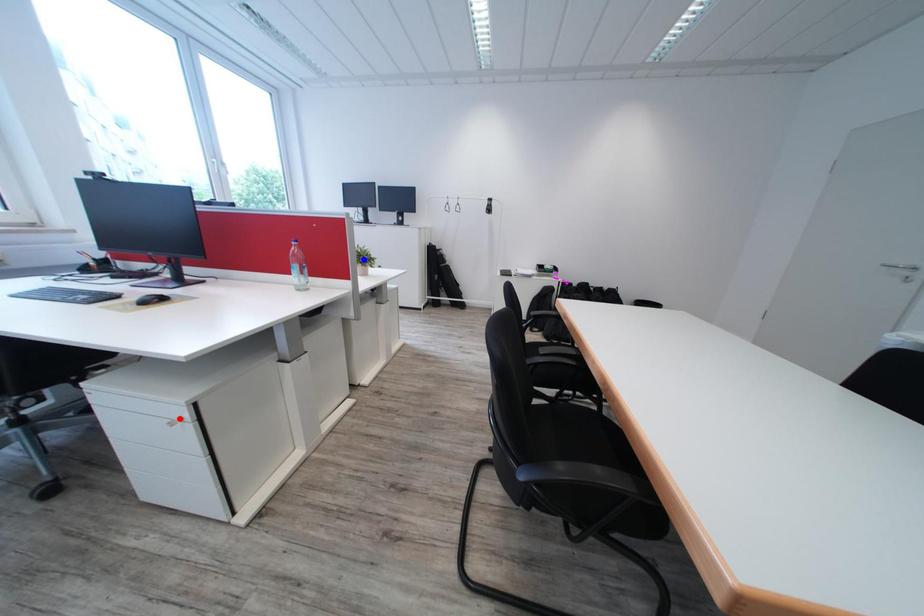
Question: Two points are marked on the image. Which point is closer to the camera?

Choices:
 (A) Blue point is closer.
 (B) Red point is closer.

Answer: (B)